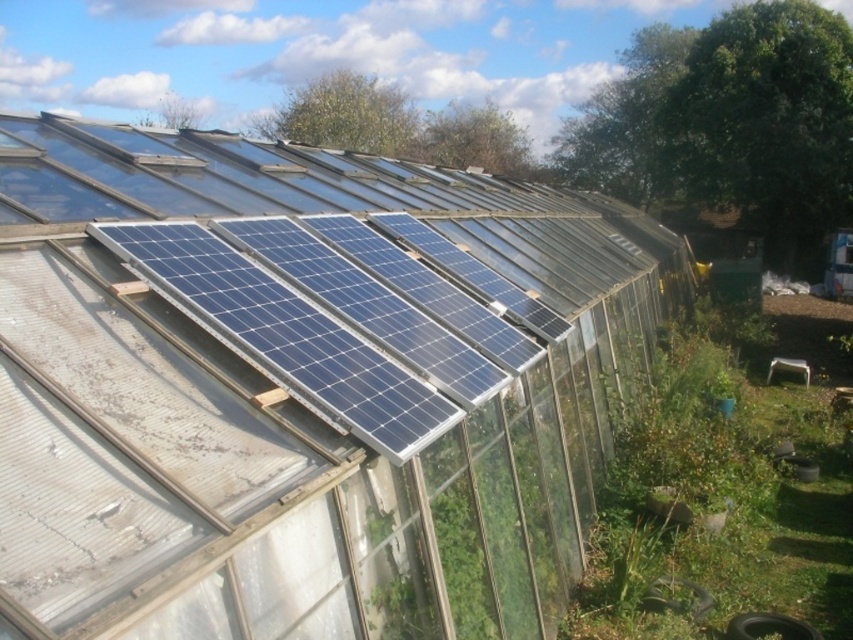
Question: Is blue solar panels at upper center in front of blue glossy solar panels at upper center?

Choices:
 (A) no
 (B) yes

Answer: (B)

Question: Which point appears farthest from the camera in this image?

Choices:
 (A) (161, 280)
 (B) (259, 387)

Answer: (A)

Question: Which point appears farthest from the camera in this image?

Choices:
 (A) (108, 332)
 (B) (115, 248)

Answer: (B)

Question: Is blue solar panels at upper center smaller than blue glossy solar panels at upper center?

Choices:
 (A) no
 (B) yes

Answer: (A)

Question: Does blue solar panels at upper center appear on the right side of blue glossy solar panels at upper center?

Choices:
 (A) no
 (B) yes

Answer: (B)